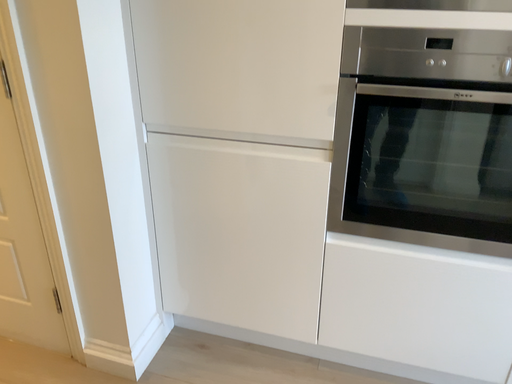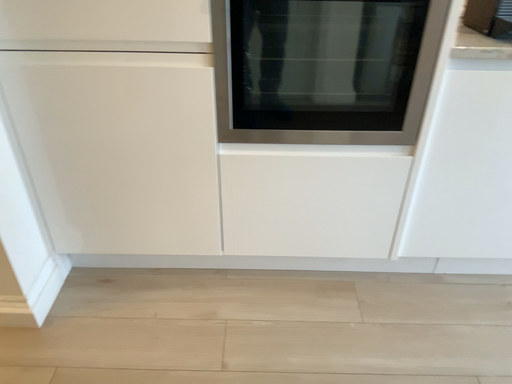
Question: How did the camera likely rotate when shooting the video?

Choices:
 (A) rotated upward
 (B) rotated downward

Answer: (B)